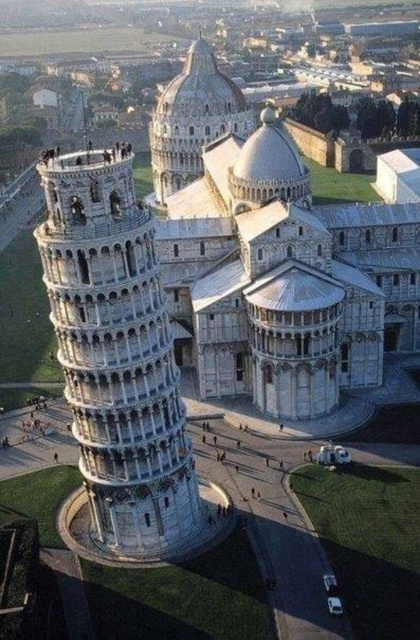
Does white stone tower at left have a larger size compared to white stone dome at upper center?

Incorrect, white stone tower at left is not larger than white stone dome at upper center.

Is point (65, 228) positioned behind point (196, 84)?

No, it is in front of (196, 84).

Where is `white stone tower at left`? The width and height of the screenshot is (420, 640). white stone tower at left is located at coordinates (118, 368).